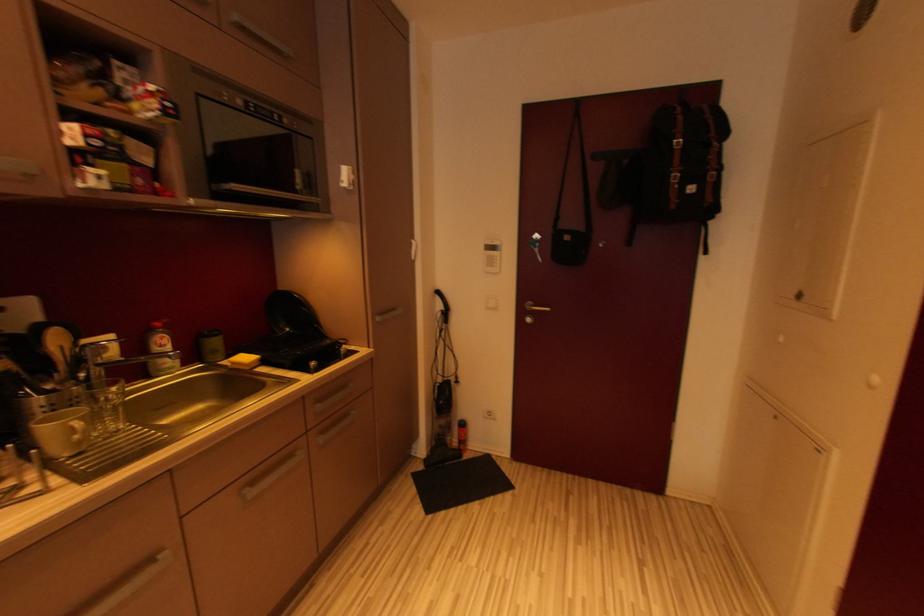
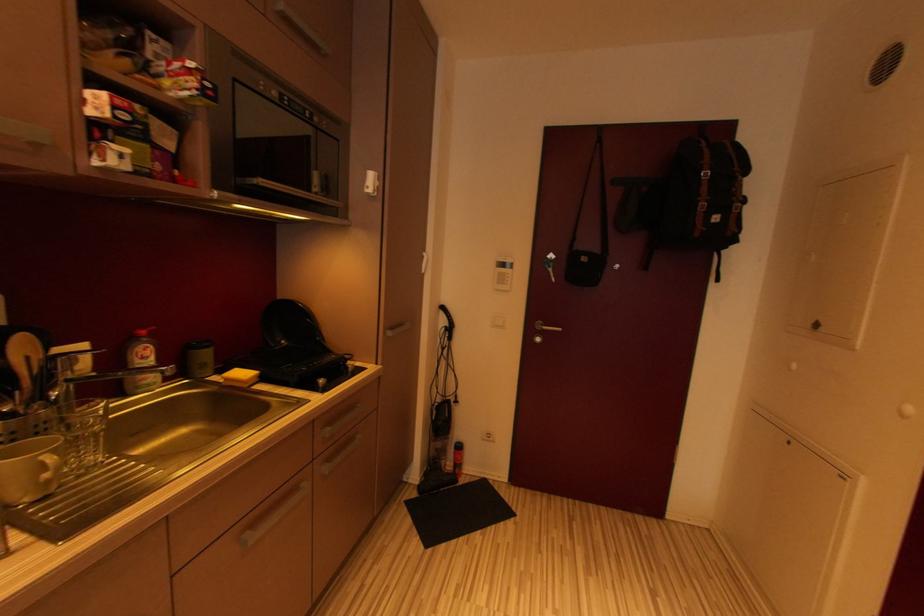
Question: The images are taken continuously from a first-person perspective. In which direction are you moving?

Choices:
 (A) Left
 (B) Right
 (C) Forward
 (D) Backward

Answer: (A)